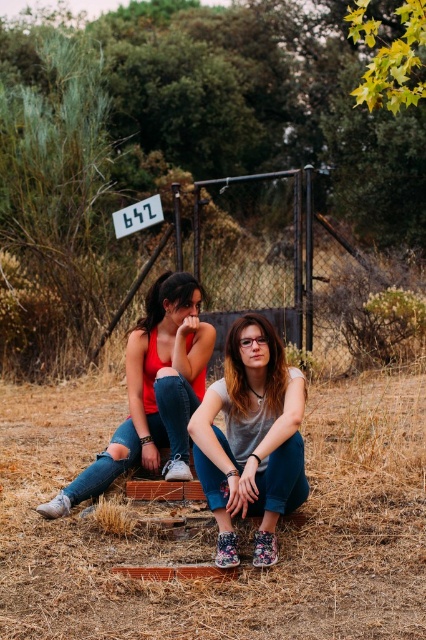
Question: Which point is farther from the camera taking this photo?

Choices:
 (A) (115, 625)
 (B) (195, 384)

Answer: (B)

Question: Is brown dry grass at lower center below matte gray shirt at center?

Choices:
 (A) yes
 (B) no

Answer: (A)

Question: Does matte gray shirt at center have a greater width compared to white plastic sign at center?

Choices:
 (A) no
 (B) yes

Answer: (A)

Question: Is matte gray shirt at center in front of matte red tank top at left?

Choices:
 (A) no
 (B) yes

Answer: (B)

Question: Which object appears farthest from the camera in this image?

Choices:
 (A) white plastic sign at center
 (B) matte gray shirt at center

Answer: (A)

Question: Which of the following is the closest to the observer?

Choices:
 (A) (146, 204)
 (B) (264, 355)
 (C) (189, 369)

Answer: (B)